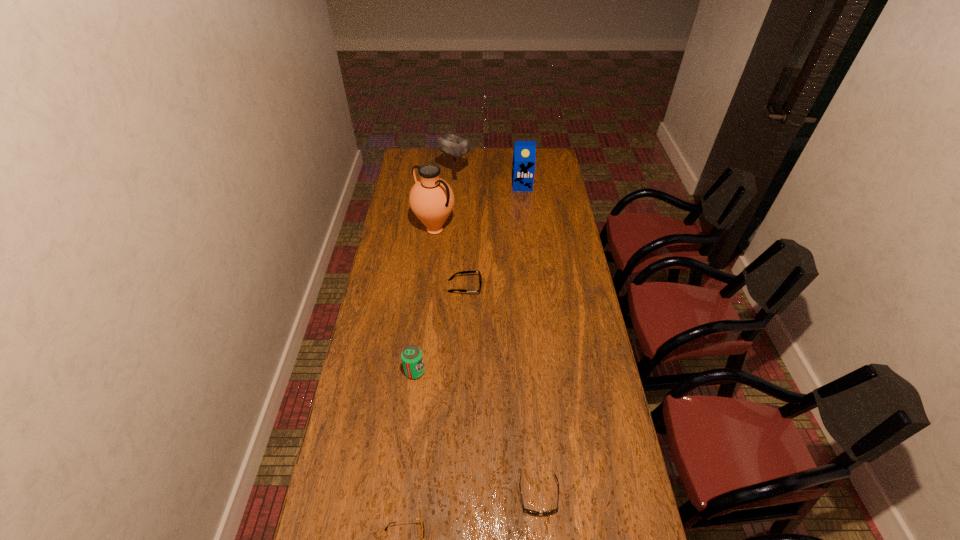
Where is `empty space that is in between the fifth farthest object and the farthest sunglasses`? This screenshot has width=960, height=540. empty space that is in between the fifth farthest object and the farthest sunglasses is located at coordinates (440, 329).

This screenshot has height=540, width=960. I want to click on free point between the carton and the farthest sunglasses, so click(x=493, y=236).

At what (x,y) coordinates should I click in order to perform the action: click on empty space between the second nearest sunglasses and the pop soda. Please return your answer as a coordinate pair (x, y). Image resolution: width=960 pixels, height=540 pixels. Looking at the image, I should click on pos(477,434).

This screenshot has height=540, width=960. I want to click on free spot between the fourth nearest object and the mallet, so click(460, 233).

You are a GUI agent. You are given a task and a screenshot of the screen. Output one action in this format:
    pyautogui.click(x=<x>, y=<y>)
    Task: Click on the free space that is in between the second sunglasses from left to right and the carton
    This screenshot has width=960, height=540.
    Given the screenshot: What is the action you would take?
    (x=493, y=236)

Point out which object is positioned as the nearest to the nearest object. Please provide its 2D coordinates. Your answer should be formatted as a tuple, i.e. [(x, y)], where the tuple contains the x and y coordinates of a point satisfying the conditions above.

[(527, 510)]

The height and width of the screenshot is (540, 960). In order to click on object identified as the second closest to the mallet in this screenshot , I will do `click(431, 199)`.

Where is `sunglasses that can be found as the closest to the nearest object`? This screenshot has width=960, height=540. sunglasses that can be found as the closest to the nearest object is located at coordinates (527, 510).

The height and width of the screenshot is (540, 960). Find the location of `the closest sunglasses relative to the fourth shortest object`. the closest sunglasses relative to the fourth shortest object is located at coordinates (462, 272).

Where is `free space that satisfies the following two spatial constraints: 1. on the front side of the third farthest object; 2. on the front-facing side of the fifth farthest object`? Image resolution: width=960 pixels, height=540 pixels. free space that satisfies the following two spatial constraints: 1. on the front side of the third farthest object; 2. on the front-facing side of the fifth farthest object is located at coordinates (419, 372).